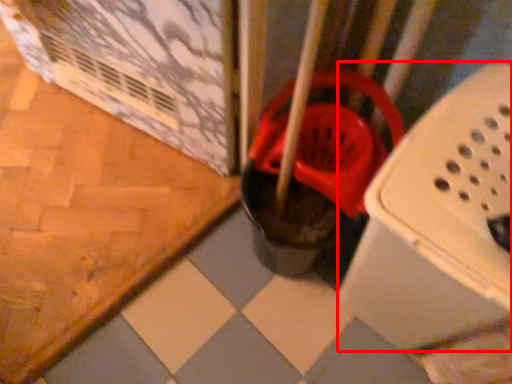
Question: From the image's perspective, where is box (annotated by the red box) located in relation to footwear in the image?

Choices:
 (A) above
 (B) below

Answer: (B)